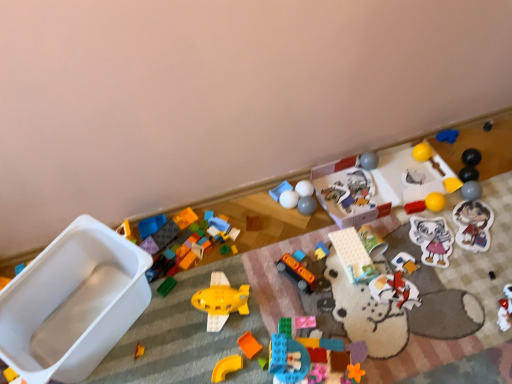
At what (x,y) coordinates should I click in order to perform the action: click on vacant space situated on the left part of yellow plastic airplane at center, the 22th toy in the right-to-left sequence. Please return your answer as a coordinate pair (x, y). Looking at the image, I should click on (167, 321).